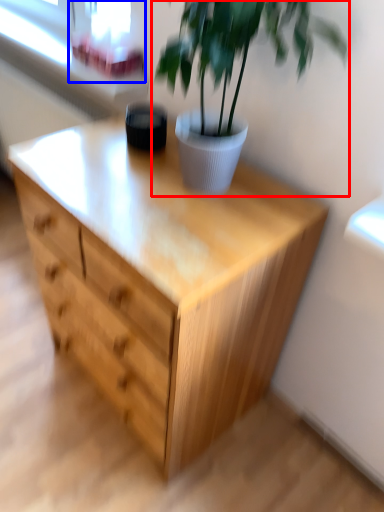
Question: Which object appears farthest to the camera in this image, houseplant (highlighted by a red box) or window screen (highlighted by a blue box)?

Choices:
 (A) houseplant
 (B) window screen

Answer: (B)